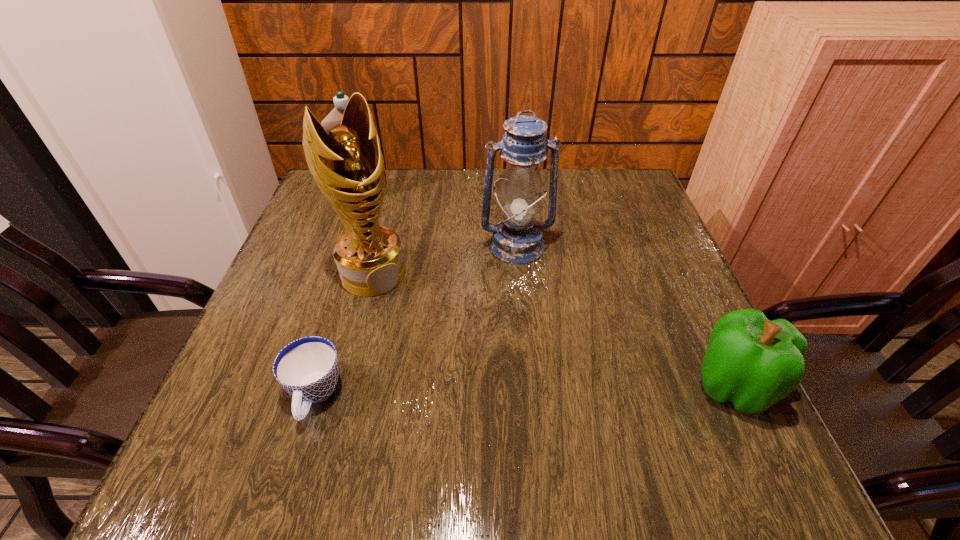
Locate an element on the screen. This screenshot has width=960, height=540. cup is located at coordinates (308, 368).

This screenshot has width=960, height=540. Identify the location of the second shortest object. (753, 362).

Locate an element on the screen. The height and width of the screenshot is (540, 960). the rightmost object is located at coordinates (753, 362).

You are a GUI agent. You are given a task and a screenshot of the screen. Output one action in this format:
    pyautogui.click(x=<x>, y=<y>)
    Task: Click on the award
    
    Given the screenshot: What is the action you would take?
    (347, 164)

Locate an element on the screen. This screenshot has width=960, height=540. the farthest object is located at coordinates (334, 118).

Find the location of a particular element. detergent is located at coordinates (334, 118).

The width and height of the screenshot is (960, 540). In order to click on lantern in this screenshot , I will do `click(517, 239)`.

This screenshot has width=960, height=540. In order to click on the fourth shortest object in this screenshot , I will do `click(517, 239)`.

You are a GUI agent. You are given a task and a screenshot of the screen. Output one action in this format:
    pyautogui.click(x=<x>, y=<y>)
    Task: Click on the vacant space located on the left of the rightmost object
    
    Given the screenshot: What is the action you would take?
    pyautogui.click(x=635, y=386)

You are a GUI agent. You are given a task and a screenshot of the screen. Output one action in this format:
    pyautogui.click(x=<x>, y=<y>)
    Task: Click on the free space located on the front-facing side of the award
    This screenshot has height=540, width=960.
    Given the screenshot: What is the action you would take?
    pyautogui.click(x=452, y=378)